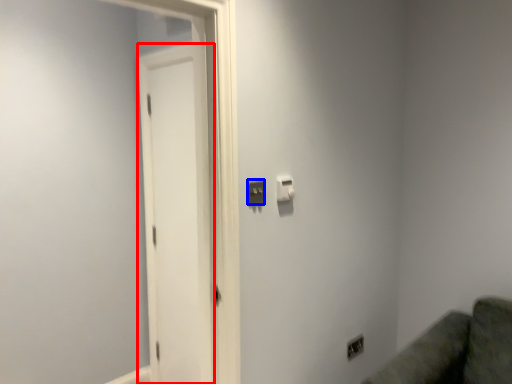
Question: Which of the following is the farthest to the observer, screen door (highlighted by a red box) or light switch (highlighted by a blue box)?

Choices:
 (A) screen door
 (B) light switch

Answer: (A)